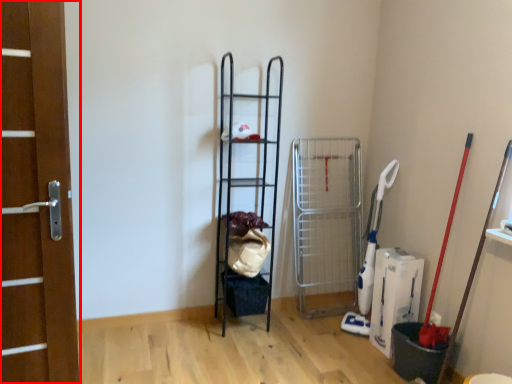
Question: From the image's perspective, what is the correct spatial positioning of door (annotated by the red box) in reference to ladder?

Choices:
 (A) below
 (B) above

Answer: (A)